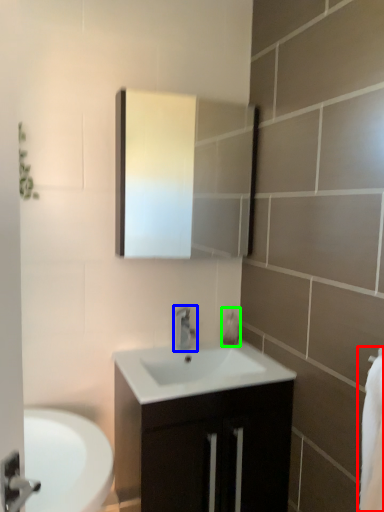
Question: Considering the real-world distances, which object is closest to bath towel (highlighted by a red box)? tap (highlighted by a blue box) or soap dispenser (highlighted by a green box).

Choices:
 (A) tap
 (B) soap dispenser

Answer: (A)